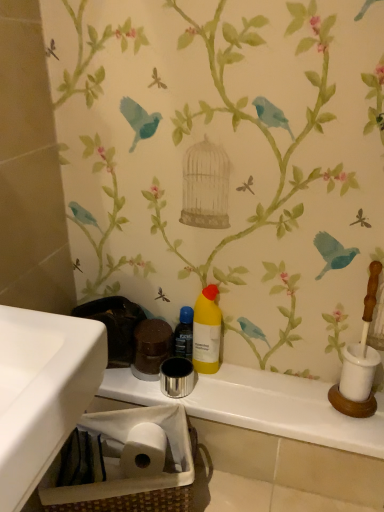
Where is `free space on the front side of translucent plastic bottle at center`? This screenshot has height=512, width=384. free space on the front side of translucent plastic bottle at center is located at coordinates (208, 392).